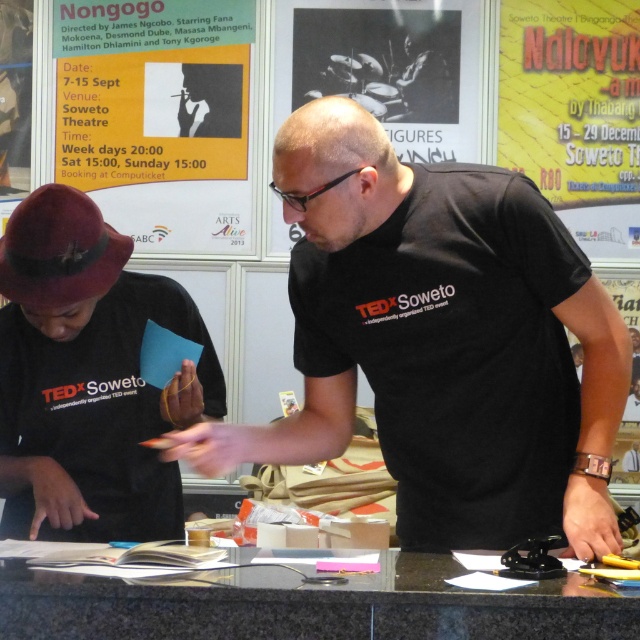
Question: Considering the relative positions of black matte shirt at center and matte black hat at left in the image provided, where is black matte shirt at center located with respect to matte black hat at left?

Choices:
 (A) above
 (B) below

Answer: (A)

Question: Which point is farther from the camera taking this photo?

Choices:
 (A) (38, 573)
 (B) (58, 420)
 (C) (424, 490)
 (D) (632, 61)

Answer: (D)

Question: Which object is the farthest from the granite table at center?

Choices:
 (A) yellow paper poster at upper center
 (B) matte paper poster at upper left
 (C) black matte shirt at center
 (D) matte black hat at left

Answer: (A)

Question: Can you confirm if black matte shirt at center is positioned below yellow paper poster at upper center?

Choices:
 (A) yes
 (B) no

Answer: (A)

Question: Observing the image, what is the correct spatial positioning of matte paper poster at upper left in reference to granite table at center?

Choices:
 (A) right
 (B) left

Answer: (B)

Question: Which object is positioned farthest from the matte black hat at left?

Choices:
 (A) matte paper poster at upper left
 (B) black matte shirt at center

Answer: (A)